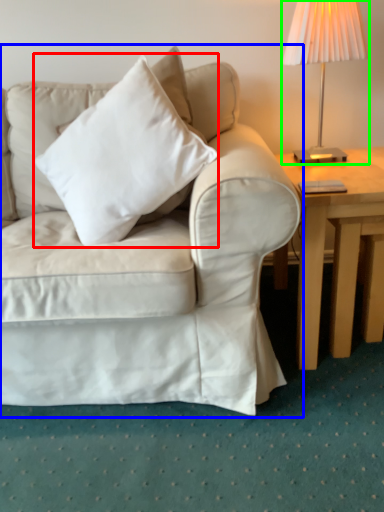
Question: Which object is the closest to the pillow (highlighted by a red box)? Choose among these: studio couch (highlighted by a blue box) or lamp (highlighted by a green box).

Choices:
 (A) studio couch
 (B) lamp

Answer: (A)